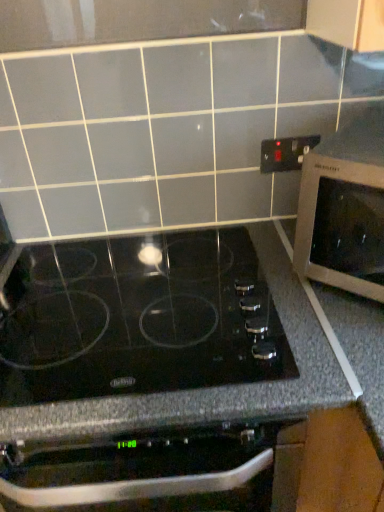
Where is `empty space that is ontop of black glass cooktop at center (from a real-world perspective)`? The height and width of the screenshot is (512, 384). empty space that is ontop of black glass cooktop at center (from a real-world perspective) is located at coordinates (124, 296).